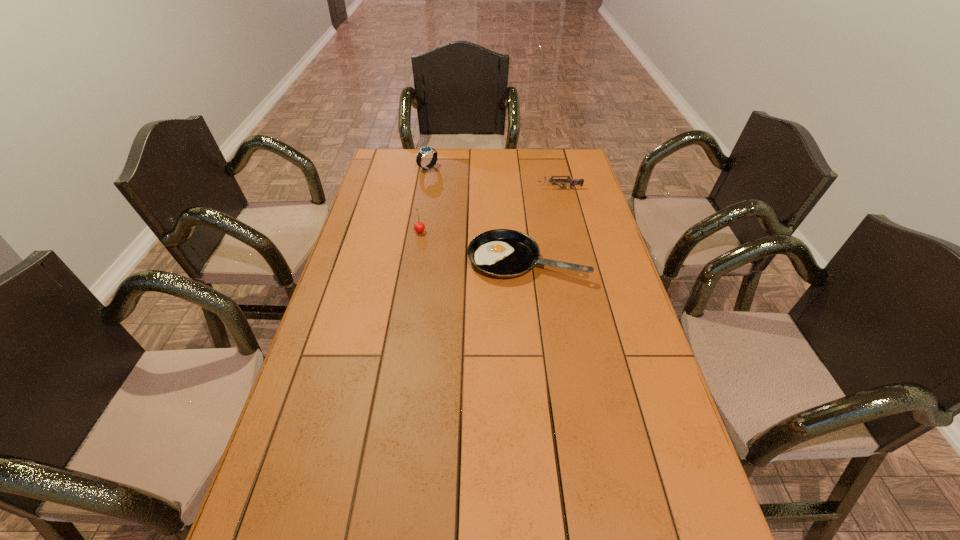
Identify the location of object that is the second closest one to the gun. pyautogui.click(x=424, y=151).

I want to click on object that is the closest to the second farthest object, so click(503, 253).

Locate an element on the screen. Image resolution: width=960 pixels, height=540 pixels. free location that satisfies the following two spatial constraints: 1. aimed along the barrel of the gun; 2. on the front side of the third farthest object is located at coordinates (570, 231).

Identify the location of free space that satisfies the following two spatial constraints: 1. on the front side of the second nearest object; 2. on the right side of the farthest object. Image resolution: width=960 pixels, height=540 pixels. (417, 231).